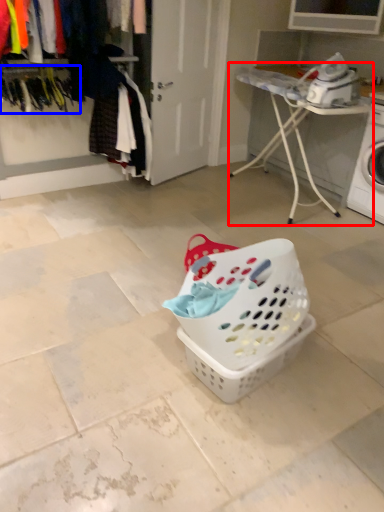
Question: Among these objects, which one is farthest to the camera, furniture (highlighted by a red box) or clothesline (highlighted by a blue box)?

Choices:
 (A) furniture
 (B) clothesline

Answer: (A)